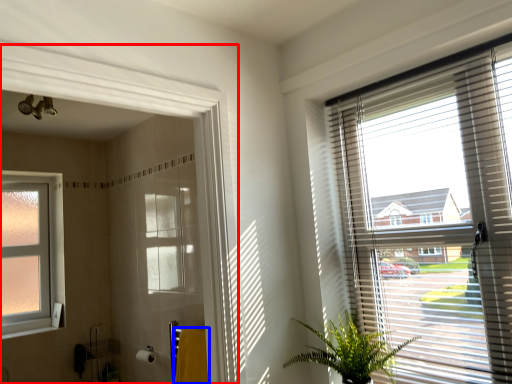
Question: Which object appears farthest to the camera in this image, screen door (highlighted by a red box) or bath towel (highlighted by a blue box)?

Choices:
 (A) screen door
 (B) bath towel

Answer: (B)